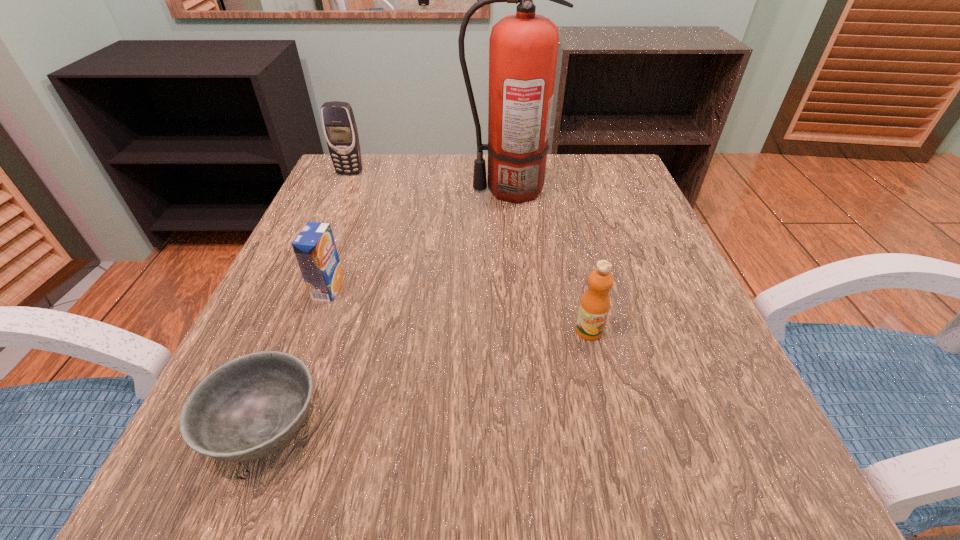
Where is `bowl that is at the left edge`? This screenshot has width=960, height=540. bowl that is at the left edge is located at coordinates (249, 407).

At what (x,y) coordinates should I click in order to perform the action: click on object at the far left corner. Please return your answer as a coordinate pair (x, y). Looking at the image, I should click on (340, 129).

This screenshot has height=540, width=960. Find the location of `object that is positioned at the near left corner`. object that is positioned at the near left corner is located at coordinates (249, 407).

In the image, there is a desktop. What are the coordinates of `vacant space at the far edge` in the screenshot? It's located at (427, 168).

Locate an element on the screen. This screenshot has width=960, height=540. vacant space at the near edge of the desktop is located at coordinates (456, 448).

The width and height of the screenshot is (960, 540). In the image, there is a desktop. Find the location of `free space at the left edge`. free space at the left edge is located at coordinates (343, 292).

At what (x,y) coordinates should I click in order to perform the action: click on vacant position at the far left corner of the desktop. Please return your answer as a coordinate pair (x, y). This screenshot has height=540, width=960. Looking at the image, I should click on (364, 203).

Where is `vacant space at the far right corner`? vacant space at the far right corner is located at coordinates (623, 164).

Image resolution: width=960 pixels, height=540 pixels. In the image, there is a desktop. Identify the location of free space at the near right corner. (776, 469).

Locate an element on the screen. The width and height of the screenshot is (960, 540). empty space between the second nearest object and the left orange_juice is located at coordinates (459, 310).